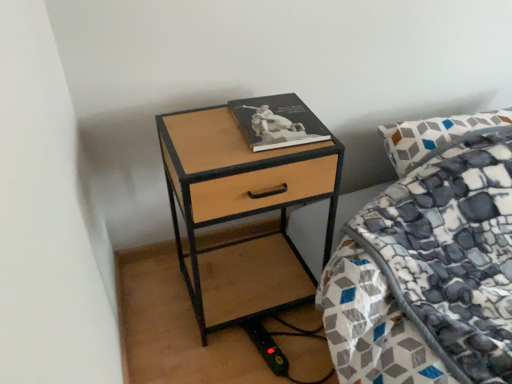
The height and width of the screenshot is (384, 512). Identify the location of empty space that is ontop of hardcover book at upper right. (275, 111).